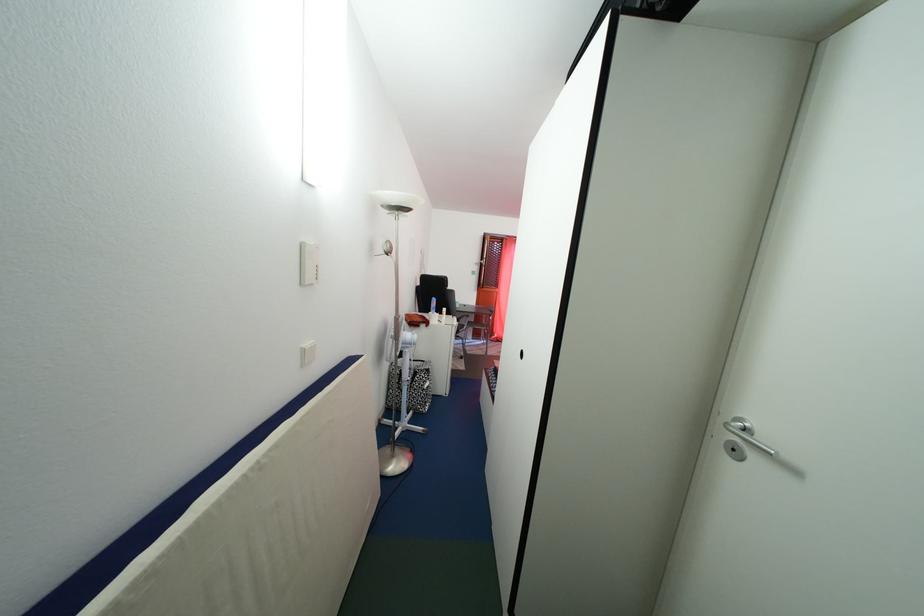
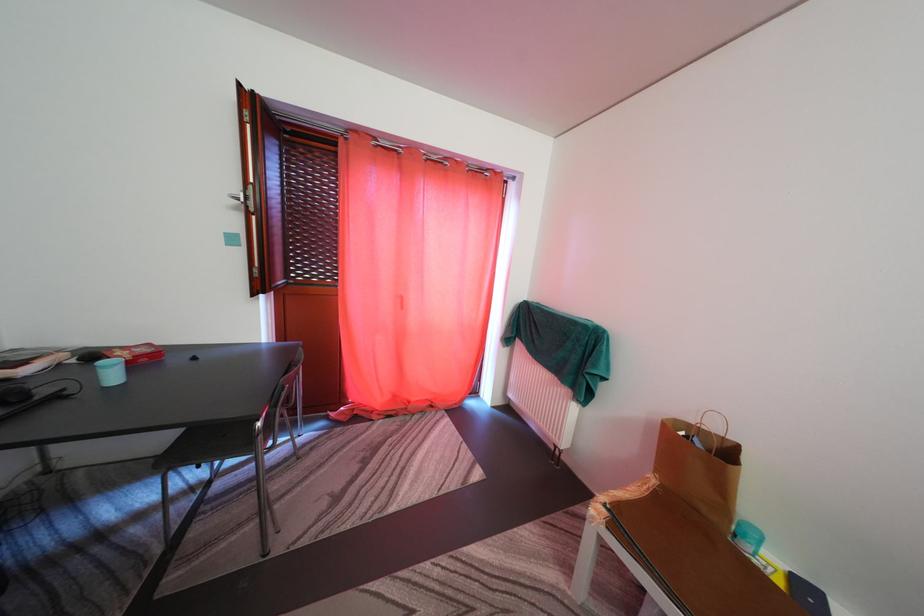
Question: Which direction would the cameraman need to move to produce the second image? Reply with the corresponding letter.

Choices:
 (A) Left
 (B) Right
 (C) Forward
 (D) Backward

Answer: (C)